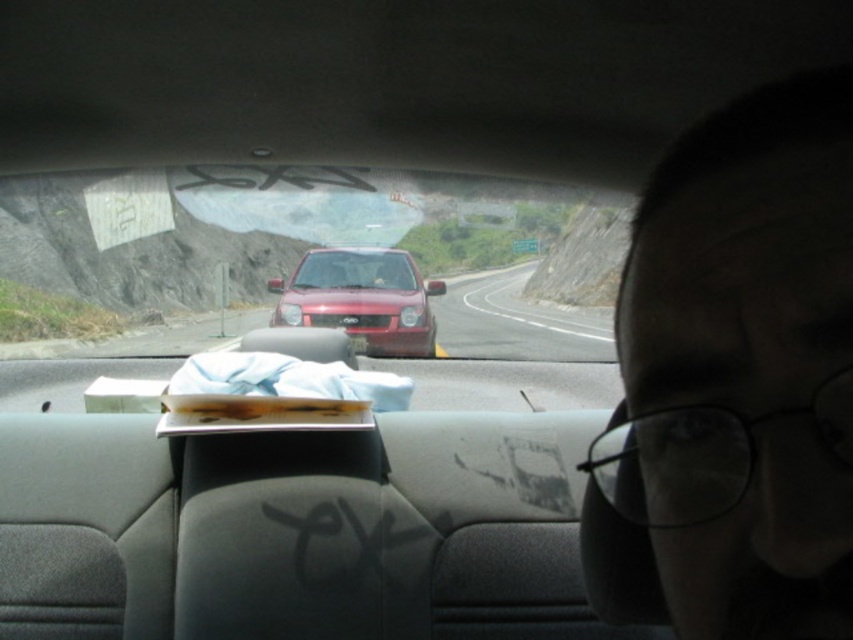
Is glossy red suv at center taller than smooth asphalt road at center?

Incorrect, glossy red suv at center's height is not larger of smooth asphalt road at center's.

From the picture: Between glossy red suv at center and smooth asphalt road at center, which one has more height?

smooth asphalt road at center is taller.

From the picture: Who is more forward, (355,317) or (558,308)?

Point (355,317) is more forward.

I want to click on glossy red suv at center, so click(x=361, y=300).

Does clear plastic glasses at right appear on the right side of glossy red suv at center?

Yes, clear plastic glasses at right is to the right of glossy red suv at center.

Does clear plastic glasses at right come in front of glossy red suv at center?

Yes.

Between point (749, 240) and point (326, 289), which one is positioned in front?

Point (749, 240) is in front.

What are the coordinates of `clear plastic glasses at right` in the screenshot? It's located at (735, 381).

From the picture: Is clear plastic glasses at right shorter than brown leather wallet at center?

In fact, clear plastic glasses at right may be taller than brown leather wallet at center.

Which is more to the left, clear plastic glasses at right or brown leather wallet at center?

brown leather wallet at center is more to the left.

Find the location of a particular element. The image size is (853, 640). clear plastic glasses at right is located at coordinates (735, 381).

At what (x,y) coordinates should I click in order to perform the action: click on clear plastic glasses at right. Please return your answer as a coordinate pair (x, y). This screenshot has width=853, height=640. Looking at the image, I should click on (735, 381).